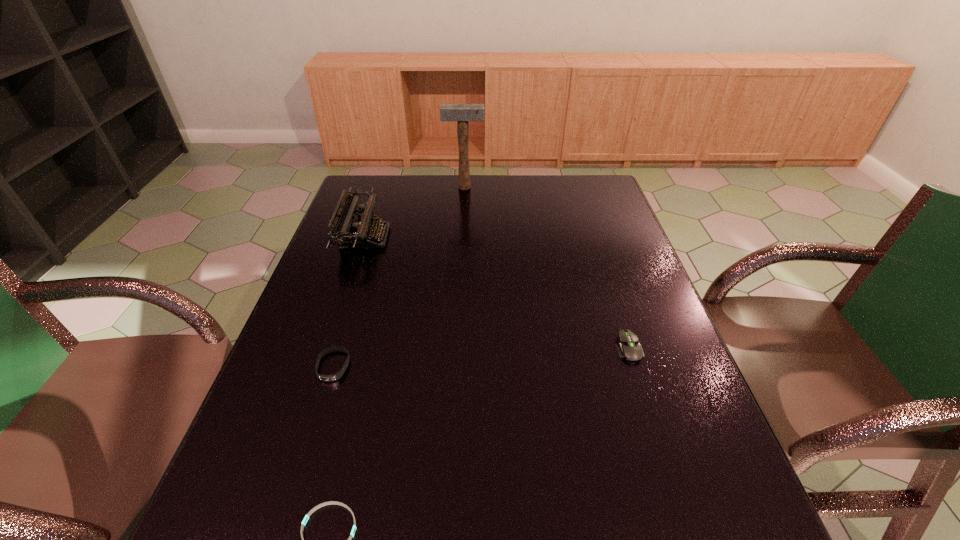
This screenshot has height=540, width=960. I want to click on vacant space that's between the farther wristband and the second tallest object, so click(348, 302).

Find the location of a particular element. The width and height of the screenshot is (960, 540). vacant area between the typewriter and the tallest object is located at coordinates (415, 212).

The width and height of the screenshot is (960, 540). Identify the location of free space between the taller wristband and the tallest object. (398, 276).

Find the location of `free point between the second tallest object and the taller wristband`. free point between the second tallest object and the taller wristband is located at coordinates (348, 302).

Where is `free point between the farther wristband and the mallet`? free point between the farther wristband and the mallet is located at coordinates (398, 276).

This screenshot has width=960, height=540. In order to click on vacant area between the computer mouse and the taller wristband in this screenshot , I will do `click(481, 357)`.

Locate an element on the screen. This screenshot has height=540, width=960. the third closest object to the taller wristband is located at coordinates pyautogui.click(x=629, y=347).

Choose which object is the nearest neighbor to the tallest object. Please provide its 2D coordinates. Your answer should be formatted as a tuple, i.e. [(x, y)], where the tuple contains the x and y coordinates of a point satisfying the conditions above.

[(348, 230)]

This screenshot has height=540, width=960. Find the location of `free spot that satisfies the following two spatial constraints: 1. on the typing side of the typewriter; 2. on the back side of the computer mouse`. free spot that satisfies the following two spatial constraints: 1. on the typing side of the typewriter; 2. on the back side of the computer mouse is located at coordinates (328, 348).

This screenshot has height=540, width=960. In order to click on free spot that satisfies the following two spatial constraints: 1. on the typing side of the computer mouse; 2. on the left side of the second tallest object in this screenshot , I will do `click(328, 348)`.